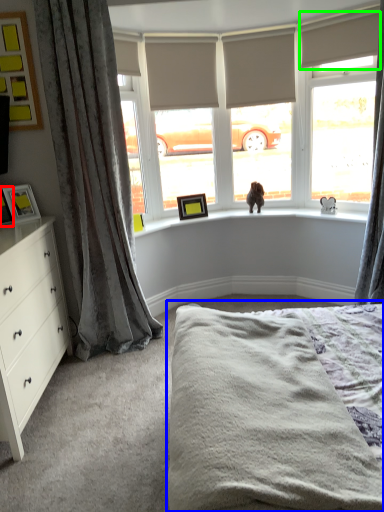
Question: Which object is the farthest from picture frame (highlighted by a red box)? Choose among these: bed (highlighted by a blue box) or blind (highlighted by a green box).

Choices:
 (A) bed
 (B) blind

Answer: (B)